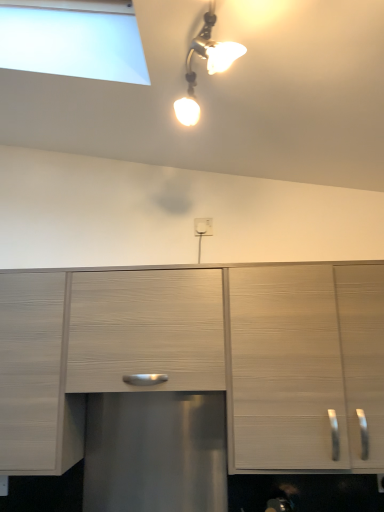
Question: Is white plastic electric outlet at center surrounding light wood drawer at center?

Choices:
 (A) no
 (B) yes

Answer: (A)

Question: Is white plastic electric outlet at center wider than light wood drawer at center?

Choices:
 (A) yes
 (B) no

Answer: (B)

Question: From a real-world perspective, is white plastic electric outlet at center positioned over light wood drawer at center based on gravity?

Choices:
 (A) no
 (B) yes

Answer: (B)

Question: From the image's perspective, does white plastic electric outlet at center appear higher than light wood drawer at center?

Choices:
 (A) yes
 (B) no

Answer: (A)

Question: Is white plastic electric outlet at center not near light wood drawer at center?

Choices:
 (A) yes
 (B) no

Answer: (B)

Question: Is white plastic electric outlet at center in front of light wood drawer at center?

Choices:
 (A) no
 (B) yes

Answer: (A)

Question: Is light wood drawer at center taller than light wood cabinet at right, the first cabinetry when ordered from right to left?

Choices:
 (A) yes
 (B) no

Answer: (B)

Question: Can you confirm if light wood drawer at center is positioned to the right of light wood cabinet at right, the second cabinetry when ordered from left to right?

Choices:
 (A) yes
 (B) no

Answer: (B)

Question: Is light wood drawer at center shorter than light wood cabinet at right, the first cabinetry when ordered from right to left?

Choices:
 (A) yes
 (B) no

Answer: (A)

Question: Can you confirm if light wood drawer at center is bigger than light wood cabinet at right, the first cabinetry when ordered from right to left?

Choices:
 (A) yes
 (B) no

Answer: (B)

Question: Is light wood drawer at center far from light wood cabinet at right, the second cabinetry when ordered from left to right?

Choices:
 (A) yes
 (B) no

Answer: (B)

Question: Is light wood drawer at center looking in the opposite direction of light wood cabinet at right, the first cabinetry when ordered from right to left?

Choices:
 (A) yes
 (B) no

Answer: (B)

Question: Is white plastic electric outlet at center facing towards light wood cabinet at right, the first cabinetry when ordered from right to left?

Choices:
 (A) no
 (B) yes

Answer: (A)